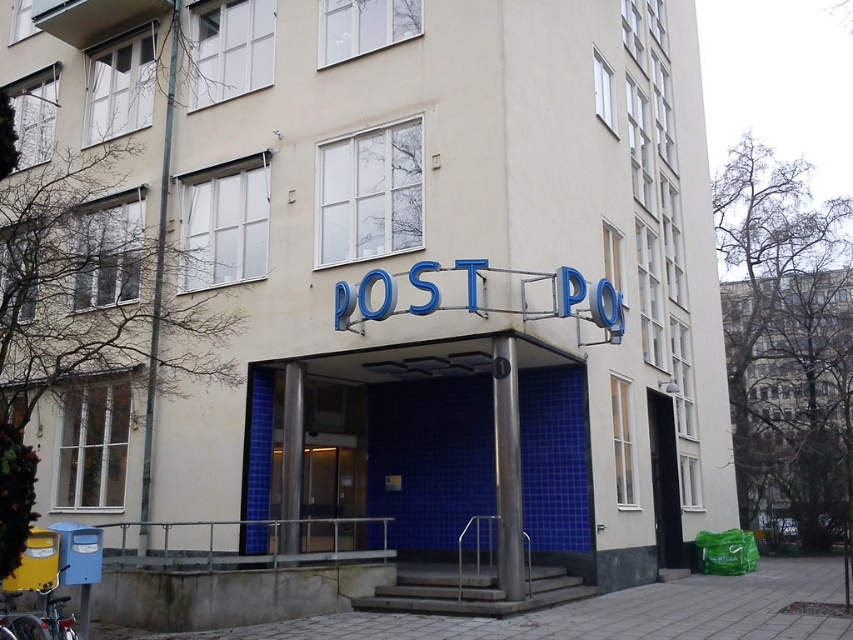
Question: Observing the image, what is the correct spatial positioning of glass door at center in reference to black glass door at center?

Choices:
 (A) right
 (B) left

Answer: (B)

Question: Which object is the closest to the blue tile building at center?

Choices:
 (A) glass door at center
 (B) black glass door at center

Answer: (B)

Question: Which object appears closest to the camera in this image?

Choices:
 (A) black glass door at center
 (B) blue tile building at center

Answer: (A)

Question: From the image, what is the correct spatial relationship of blue tile building at center in relation to black glass door at center?

Choices:
 (A) left
 (B) right

Answer: (B)

Question: Is blue tile building at center above glass door at center?

Choices:
 (A) no
 (B) yes

Answer: (B)

Question: Which point is closer to the camera?

Choices:
 (A) glass door at center
 (B) blue tile building at center

Answer: (A)